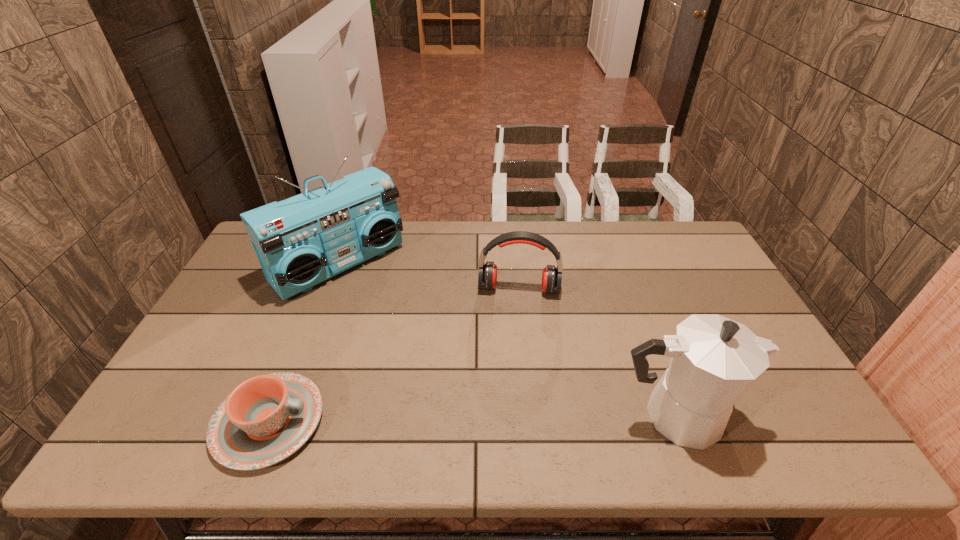
Where is `blank space located 0.170m on the front-facing side of the radio receiver`? blank space located 0.170m on the front-facing side of the radio receiver is located at coordinates (406, 325).

In order to click on vacant space located on the front-facing side of the radio receiver in this screenshot , I will do `click(389, 309)`.

Identify the location of free space located 0.220m on the front-facing side of the radio receiver. The width and height of the screenshot is (960, 540). click(417, 335).

The image size is (960, 540). What are the coordinates of `object that is at the far edge` in the screenshot? It's located at (301, 241).

You are a GUI agent. You are given a task and a screenshot of the screen. Output one action in this format:
    pyautogui.click(x=<x>, y=<y>)
    Task: Click on the chinaware that is at the near edge
    
    Given the screenshot: What is the action you would take?
    pyautogui.click(x=267, y=418)

Identify the location of coffeepot that is at the near edge. The width and height of the screenshot is (960, 540). (713, 360).

At what (x,y) coordinates should I click in order to perform the action: click on object located in the left edge section of the desktop. Please return your answer as a coordinate pair (x, y). This screenshot has height=540, width=960. Looking at the image, I should click on (301, 241).

What are the coordinates of `object that is at the far left corner` in the screenshot? It's located at [301, 241].

I want to click on vacant space at the far edge of the desktop, so click(x=426, y=251).

Identify the location of blank area at the near edge. (497, 387).